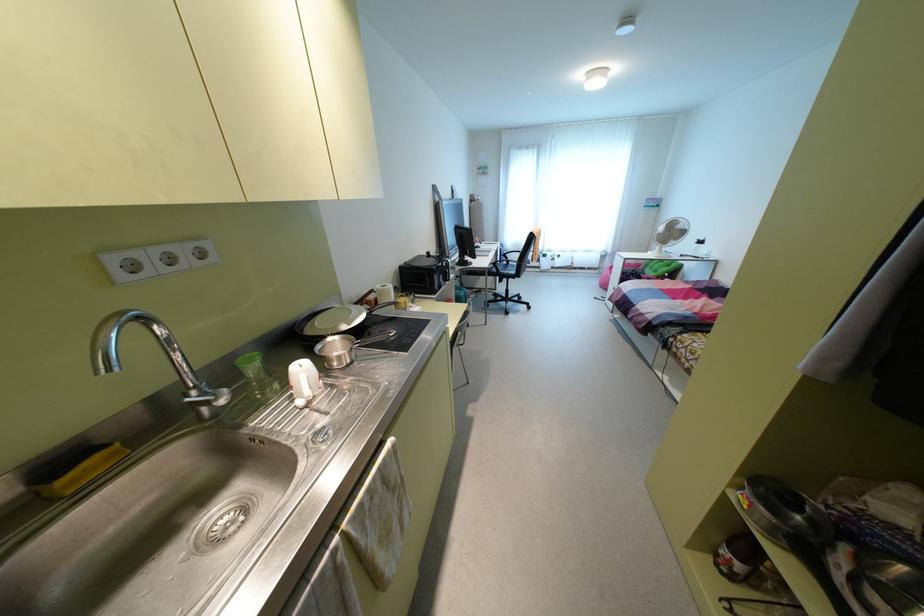
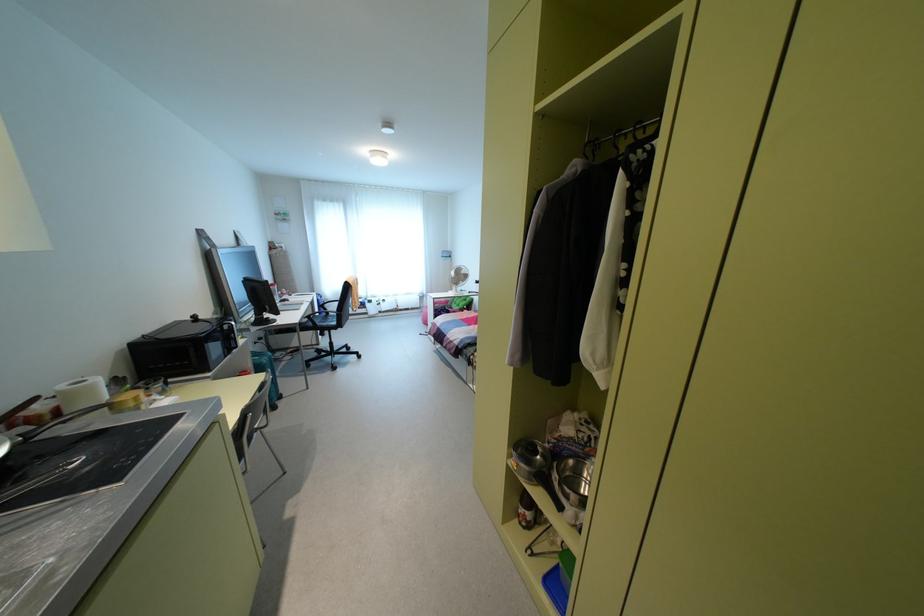
Locate, in the second image, the point that corresponds to point 378,286 in the first image.

(62, 387)